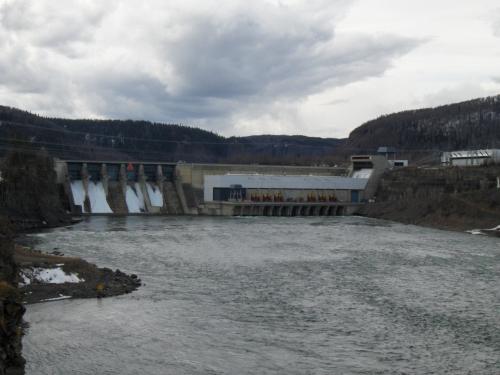
Where is `door`? Image resolution: width=500 pixels, height=375 pixels. door is located at coordinates (354, 196).